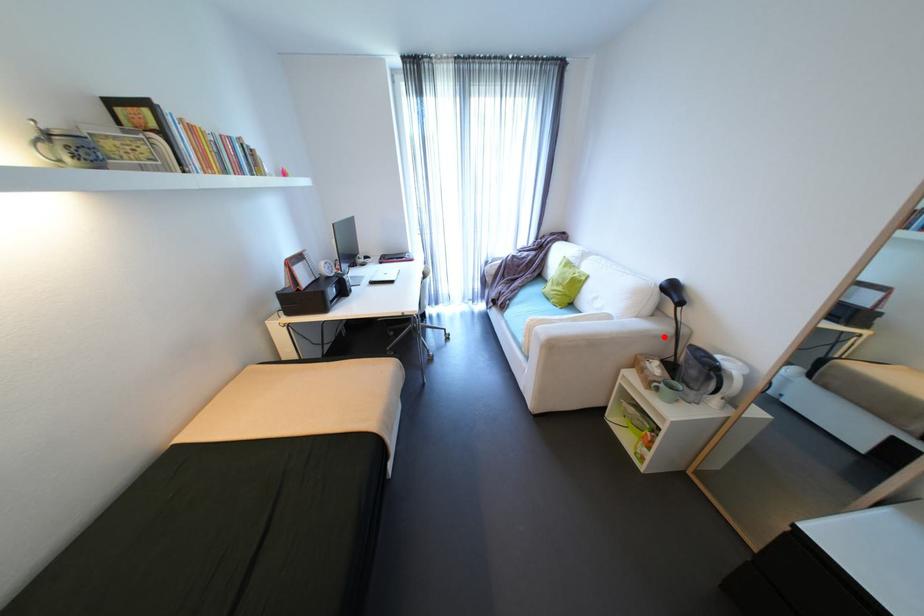
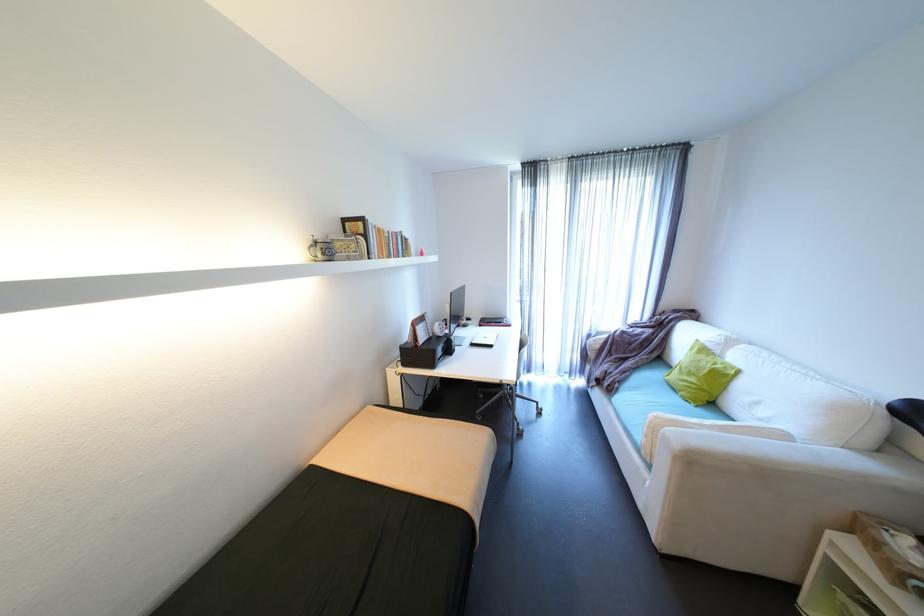
Question: I am providing you with two images of the same scene from different viewpoints. A red point is marked on the first image. Can you still see the location of the red point in image 2?

Choices:
 (A) Yes
 (B) No

Answer: (A)